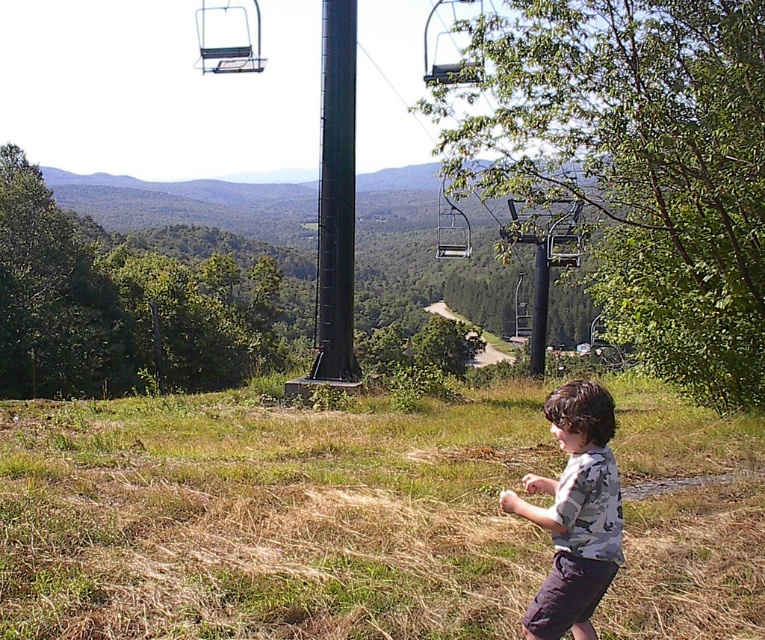
Question: Which point is farther from the camera taking this photo?

Choices:
 (A) (427, 61)
 (B) (339, 35)
 (C) (217, 52)

Answer: (A)

Question: Is camouflage shirt at lower right behind metallic blue chairlift at upper center?

Choices:
 (A) yes
 (B) no

Answer: (B)

Question: Can you confirm if camouflage shirt at lower right is wider than black matte pole at center?

Choices:
 (A) no
 (B) yes

Answer: (A)

Question: Which object is closer to the camera taking this photo?

Choices:
 (A) black matte pole at center
 (B) camouflage shirt at lower right
 (C) metallic blue chairlift at upper center
 (D) metallic gray ski lift at upper center

Answer: (B)

Question: Which object appears closest to the camera in this image?

Choices:
 (A) metallic blue chairlift at upper center
 (B) camouflage shirt at lower right
 (C) metallic silver ski lift at center
 (D) metallic gray ski lift at upper center

Answer: (B)

Question: Is metallic silver ski lift at center below metallic gray ski lift at upper center?

Choices:
 (A) yes
 (B) no

Answer: (A)